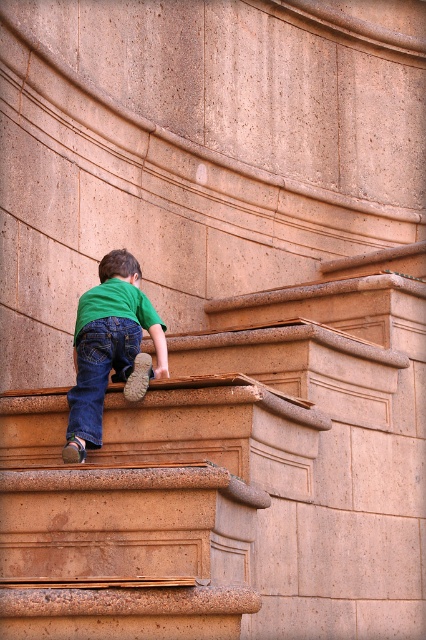
Does green matte shirt at upper center have a smaller size compared to denim/jeans at lower left?

Yes.

Between point (121, 378) and point (69, 396), which one is positioned behind?

Positioned behind is point (121, 378).

Image resolution: width=426 pixels, height=640 pixels. Identify the location of green matte shirt at upper center. (109, 348).

Which is more to the left, brown stone stairs at center or denim/jeans at lower left?

From the viewer's perspective, denim/jeans at lower left appears more on the left side.

Which is in front, point (244, 388) or point (77, 372)?

Positioned in front is point (244, 388).

This screenshot has height=640, width=426. What do you see at coordinates (235, 477) in the screenshot?
I see `brown stone stairs at center` at bounding box center [235, 477].

The height and width of the screenshot is (640, 426). I want to click on brown stone stairs at center, so [235, 477].

Describe the element at coordinates (235, 477) in the screenshot. This screenshot has width=426, height=640. I see `brown stone stairs at center` at that location.

Between brown stone stairs at center and green matte shirt at upper center, which one appears on the right side from the viewer's perspective?

brown stone stairs at center is more to the right.

Is point (340, 314) closer to camera compared to point (115, 269)?

No, it is behind (115, 269).

At what (x,y) coordinates should I click in order to perform the action: click on brown stone stairs at center. Please return your answer as a coordinate pair (x, y). The height and width of the screenshot is (640, 426). Looking at the image, I should click on (235, 477).